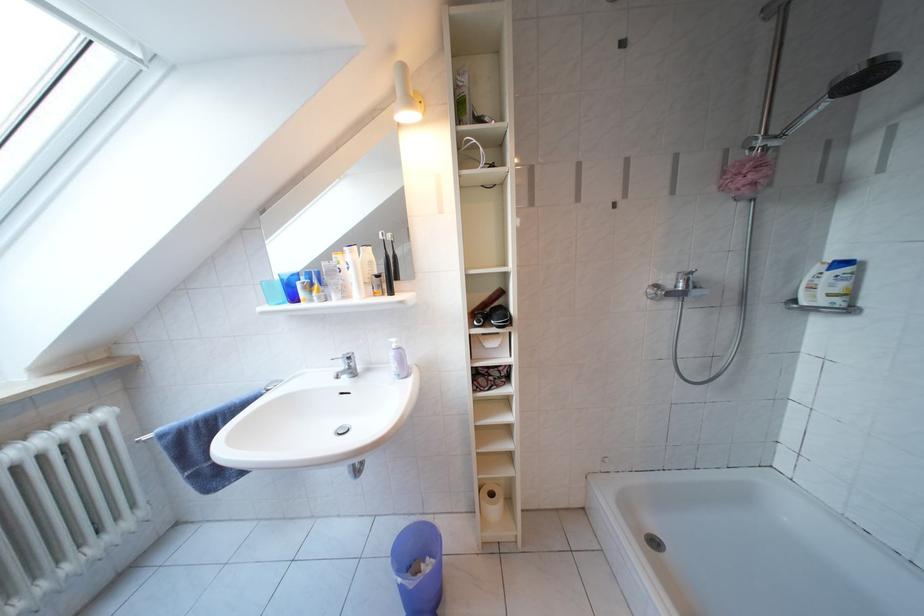
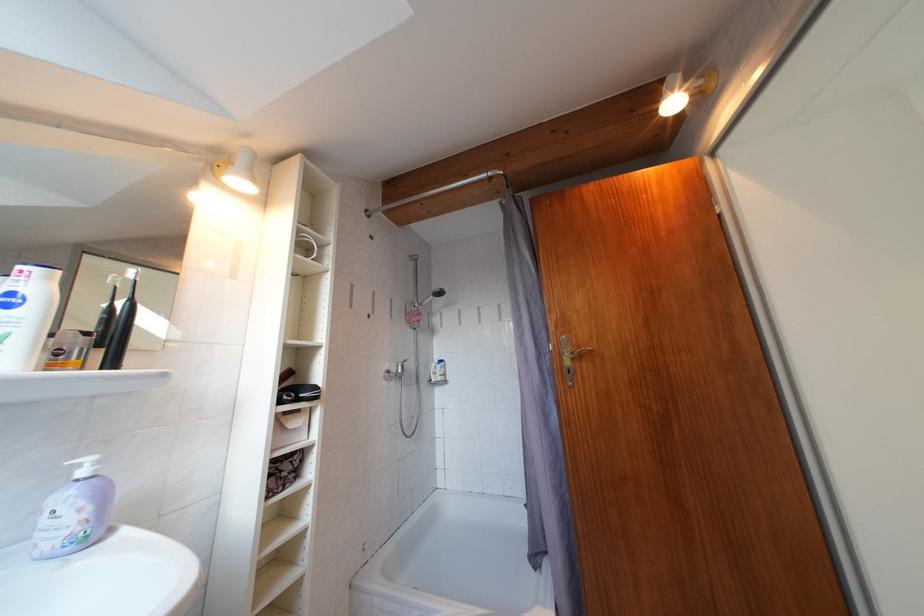
Where in the second image is the point corresponding to pixel 665 292 from the first image?

(396, 377)